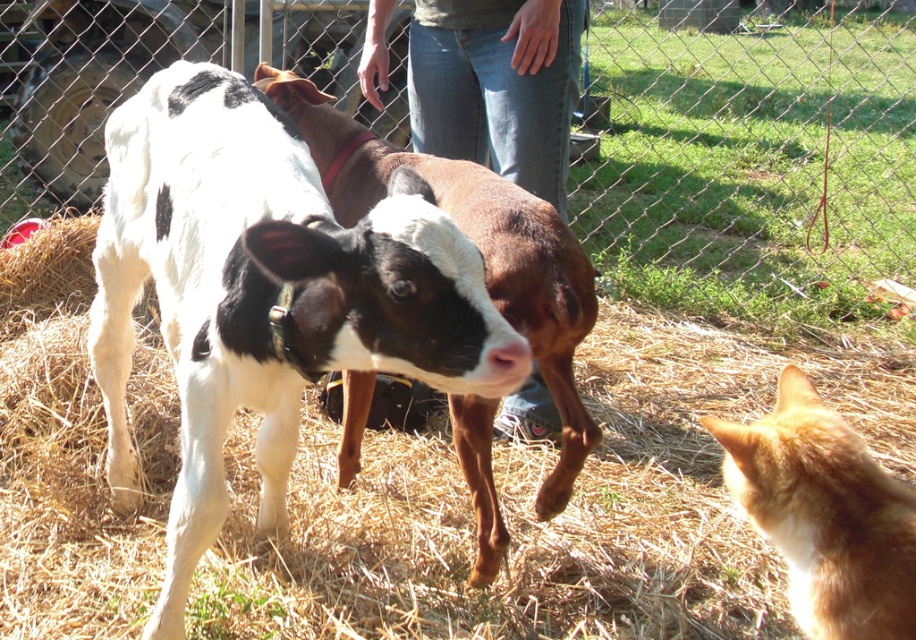
Question: Which object is positioned closest to the black and white cow at center?

Choices:
 (A) brown straw at center
 (B) orange fur cat at lower right

Answer: (A)

Question: Is wire mesh fence at center bigger than jeans at center?

Choices:
 (A) yes
 (B) no

Answer: (A)

Question: Based on their relative distances, which object is nearer to the orange fur cat at lower right?

Choices:
 (A) wire mesh fence at center
 (B) jeans at center
 (C) black and white cow at center
 (D) brown straw at center

Answer: (C)

Question: Can you confirm if black and white cow at center is positioned to the right of orange fur cat at lower right?

Choices:
 (A) no
 (B) yes

Answer: (A)

Question: Which object is positioned closest to the brown straw at center?

Choices:
 (A) orange fur cat at lower right
 (B) black and white cow at center
 (C) jeans at center

Answer: (B)

Question: Where is wire mesh fence at center located in relation to orange fur cat at lower right in the image?

Choices:
 (A) left
 (B) right

Answer: (B)